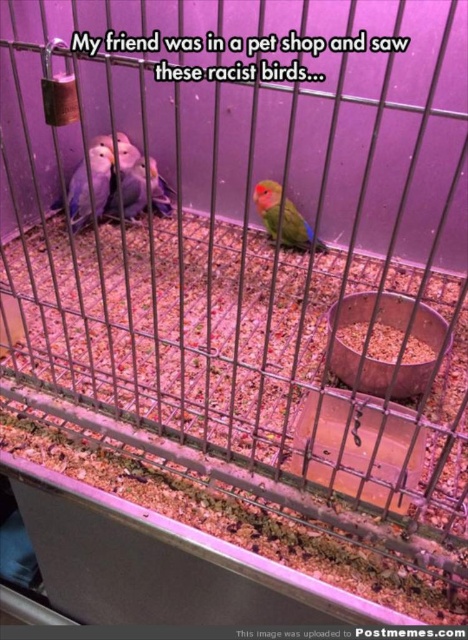
Question: Which object is farther from the camera taking this photo?

Choices:
 (A) matte orange parrot at center
 (B) matte blue bird at center-left

Answer: (B)

Question: Which object is farther from the camera taking this photo?

Choices:
 (A) matte orange parrot at center
 (B) matte blue bird at center-left

Answer: (B)

Question: Can you confirm if matte blue bird at center-left is positioned below matte orange parrot at center?

Choices:
 (A) no
 (B) yes

Answer: (A)

Question: Can you confirm if matte blue bird at center-left is positioned to the right of matte orange parrot at center?

Choices:
 (A) no
 (B) yes

Answer: (A)

Question: Can you confirm if matte blue bird at center-left is positioned to the right of matte orange parrot at center?

Choices:
 (A) no
 (B) yes

Answer: (A)